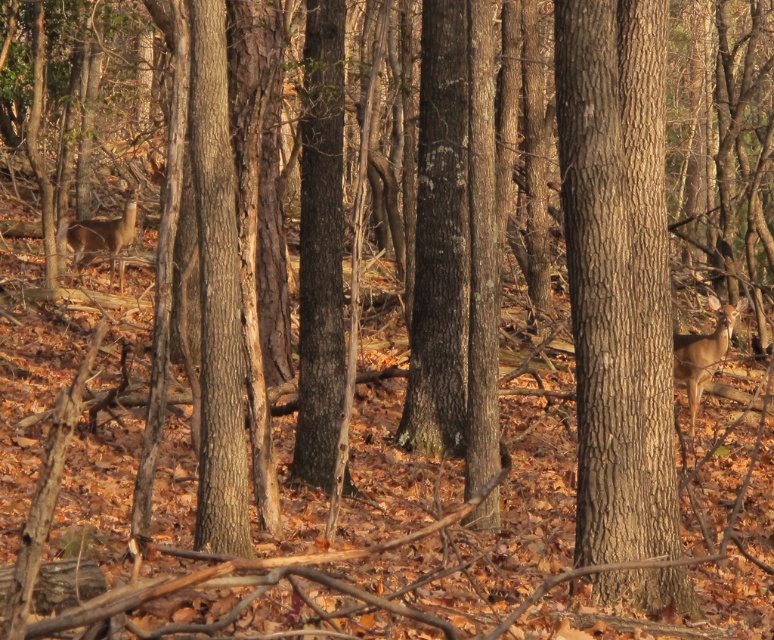
You are an archer in the forest and see the brown matte deer at right. Where exactly is the deer located in the image?

The brown matte deer at right is located at the 2D coordinates of point (701, 353) in the image.